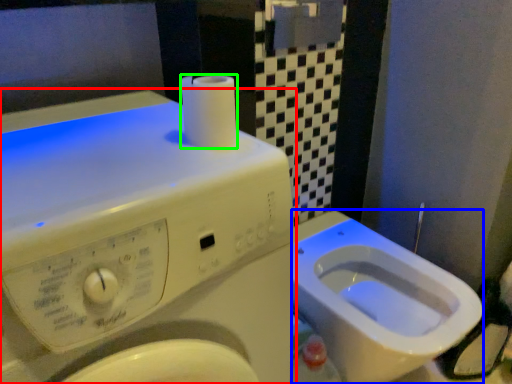
Question: Which object is the farthest from washing machine (highlighted by a red box)? Choose among these: bidet (highlighted by a blue box) or toilet paper (highlighted by a green box).

Choices:
 (A) bidet
 (B) toilet paper

Answer: (A)